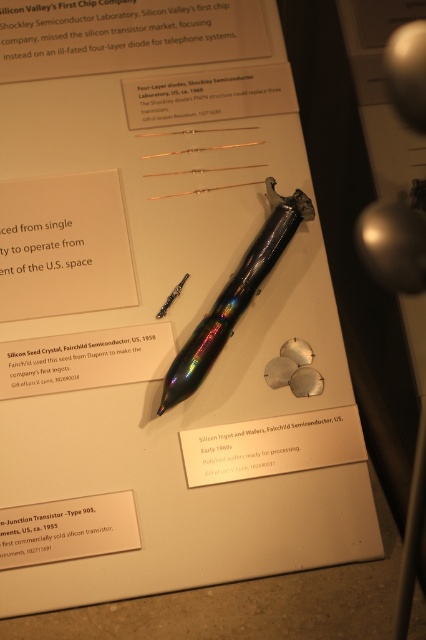
The height and width of the screenshot is (640, 426). Identify the location of black paper at upper center. (115, 35).

Is iridescent metallic pen at center below rainbow iridescent pen at center?

No.

Does iridescent metallic pen at center appear on the left side of rainbow iridescent pen at center?

Correct, you'll find iridescent metallic pen at center to the left of rainbow iridescent pen at center.

Who is more distant from viewer, (253, 86) or (226, 339)?

Positioned behind is point (253, 86).

The image size is (426, 640). Identify the location of iridescent metallic pen at center. (209, 96).

Does matte black transistor at lower left have a larger size compared to iridescent metallic fountain pen at center?

Indeed, matte black transistor at lower left has a larger size compared to iridescent metallic fountain pen at center.

Does matte black transistor at lower left appear on the left side of iridescent metallic fountain pen at center?

Yes, matte black transistor at lower left is to the left of iridescent metallic fountain pen at center.

Is point (86, 541) behind point (181, 278)?

That is False.

You are a GUI agent. You are given a task and a screenshot of the screen. Output one action in this format:
    pyautogui.click(x=<x>, y=<y>)
    Task: Click on the matte black transistor at lower left
    
    Given the screenshot: What is the action you would take?
    pyautogui.click(x=63, y=531)